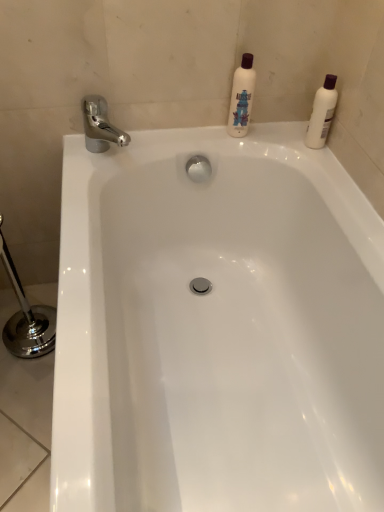
Find the location of a particular element. blank area to the left of white plastic bottle at upper right, which is the 2th cleaning product from left to right is located at coordinates 272,134.